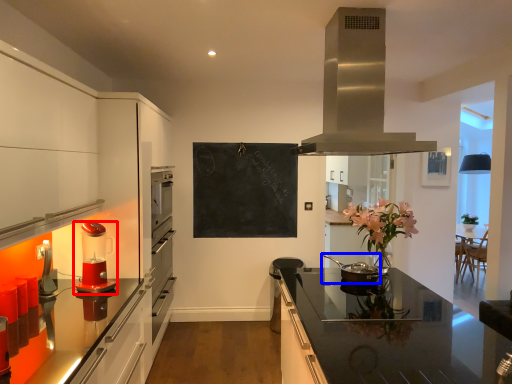
Question: Among these objects, which one is nearest to the camera, kitchen appliance (highlighted by a red box) or kitchen appliance (highlighted by a blue box)?

Choices:
 (A) kitchen appliance
 (B) kitchen appliance

Answer: (A)